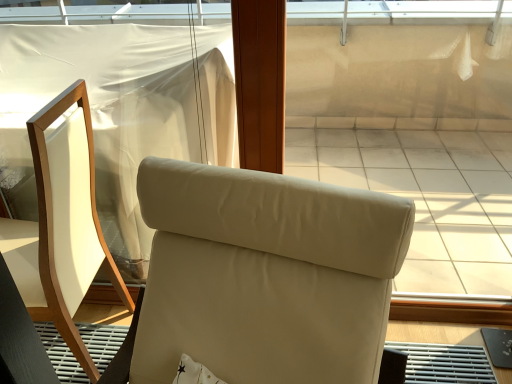
Question: From a real-world perspective, is beige leather chair at center, positioned as the 1th chair in right-to-left order, physically located above or below matte white chair at left, which is the 2th chair in right-to-left order?

Choices:
 (A) below
 (B) above

Answer: (A)

Question: Considering the positions of beige leather chair at center, which is the second chair from left to right, and matte white chair at left, which is the 2th chair in right-to-left order, in the image, is beige leather chair at center, which is the second chair from left to right, wider or thinner than matte white chair at left, which is the 2th chair in right-to-left order,?

Choices:
 (A) wide
 (B) thin

Answer: (A)

Question: Considering the positions of point (382, 279) and point (80, 162), is point (382, 279) closer or farther from the camera than point (80, 162)?

Choices:
 (A) closer
 (B) farther

Answer: (A)

Question: Relative to beige leather chair at center, which is the second chair from left to right, is matte white chair at left, arranged as the first chair when viewed from the left, in front or behind?

Choices:
 (A) behind
 (B) front

Answer: (A)

Question: From the image's perspective, is matte white chair at left, which is the 2th chair in right-to-left order, above or below beige leather chair at center, which is the second chair from left to right?

Choices:
 (A) below
 (B) above

Answer: (B)

Question: Based on their positions, is matte white chair at left, which is the 2th chair in right-to-left order, located to the left or right of beige leather chair at center, positioned as the 1th chair in right-to-left order?

Choices:
 (A) right
 (B) left

Answer: (B)

Question: From a real-world perspective, relative to beige leather chair at center, which is the second chair from left to right, is matte white chair at left, which is the 2th chair in right-to-left order, vertically above or below?

Choices:
 (A) above
 (B) below

Answer: (A)